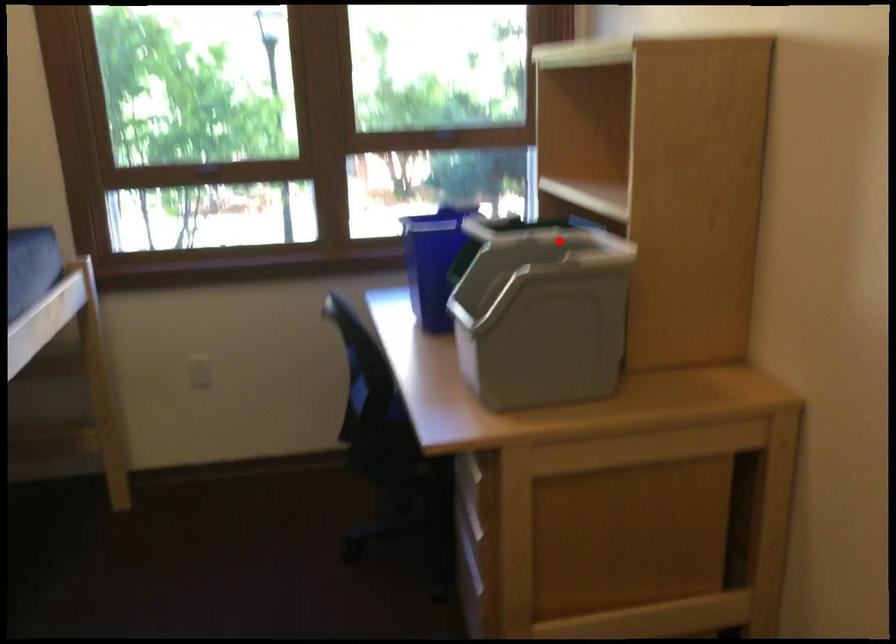
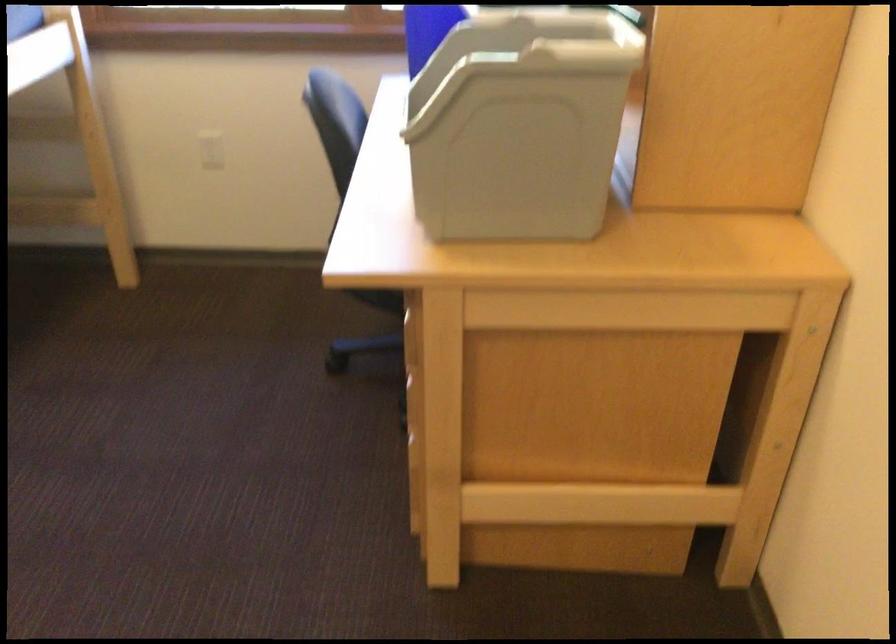
Question: A red point is marked in image1. In image2, is the corresponding 3D point closer to the camera or farther? Reply with the corresponding letter.

Choices:
 (A) The corresponding 3D point is closer.
 (B) The corresponding 3D point is farther.

Answer: (A)